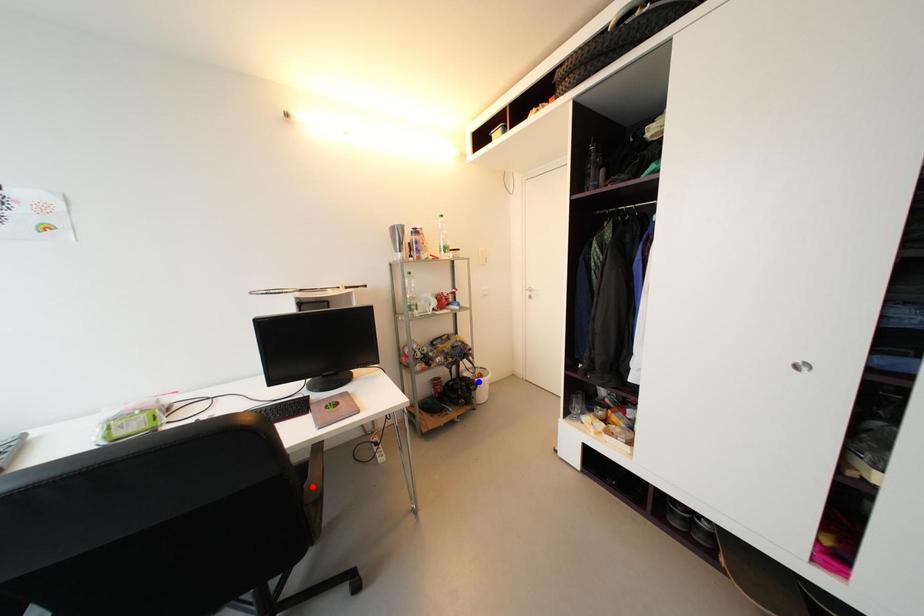
Question: Two points are marked on the image. Which point is closer to the camera?

Choices:
 (A) Blue point is closer.
 (B) Red point is closer.

Answer: (B)